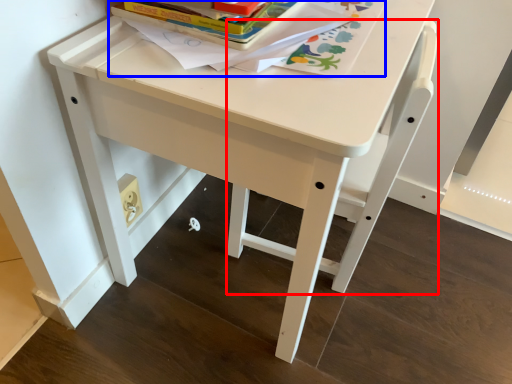
Question: Which point is closer to the camera, chair (highlighted by a red box) or book (highlighted by a blue box)?

Choices:
 (A) chair
 (B) book

Answer: (B)